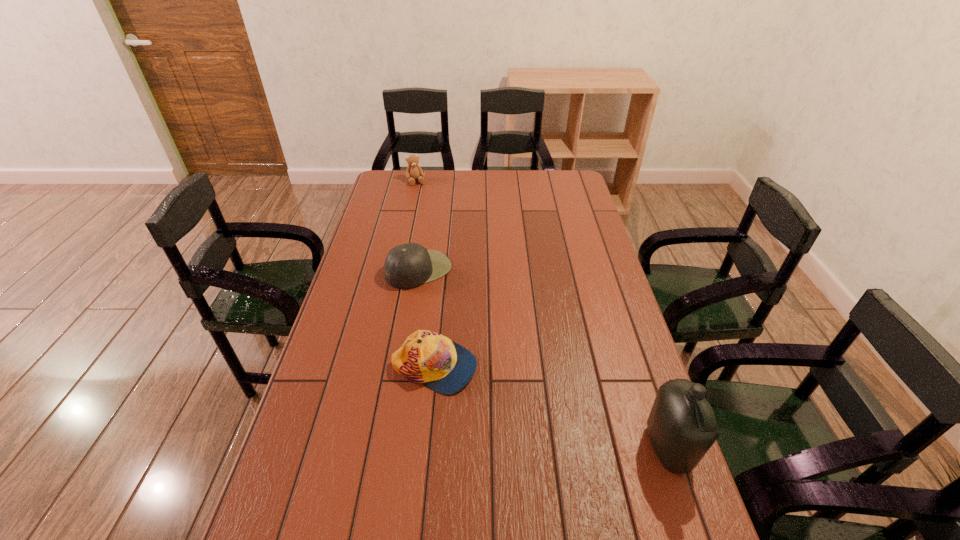
Identify the location of vacant area situated 0.240m on the front-facing side of the teddy bear. The height and width of the screenshot is (540, 960). (430, 213).

The width and height of the screenshot is (960, 540). Identify the location of vacant region located 0.200m on the front-facing side of the teddy bear. (428, 208).

Locate an element on the screen. vacant area located on the front-facing side of the teddy bear is located at coordinates (423, 198).

The image size is (960, 540). What are the coordinates of `object present at the far edge` in the screenshot? It's located at (414, 171).

Identify the location of cap present at the left edge. This screenshot has height=540, width=960. (407, 266).

Where is `teddy bear situated at the left edge`? The image size is (960, 540). teddy bear situated at the left edge is located at coordinates pos(414,171).

Find the location of a particular element. object present at the right edge is located at coordinates (682, 427).

Identify the location of object located in the far left corner section of the desktop. (414, 171).

Locate an element on the screen. The width and height of the screenshot is (960, 540). vacant area at the far edge of the desktop is located at coordinates (487, 183).

The height and width of the screenshot is (540, 960). I want to click on vacant point at the left edge, so click(372, 276).